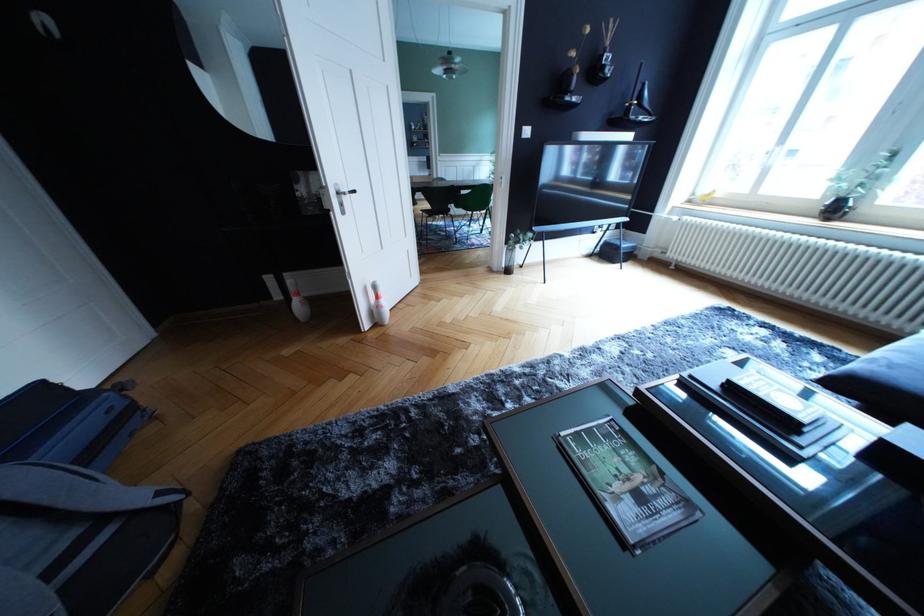
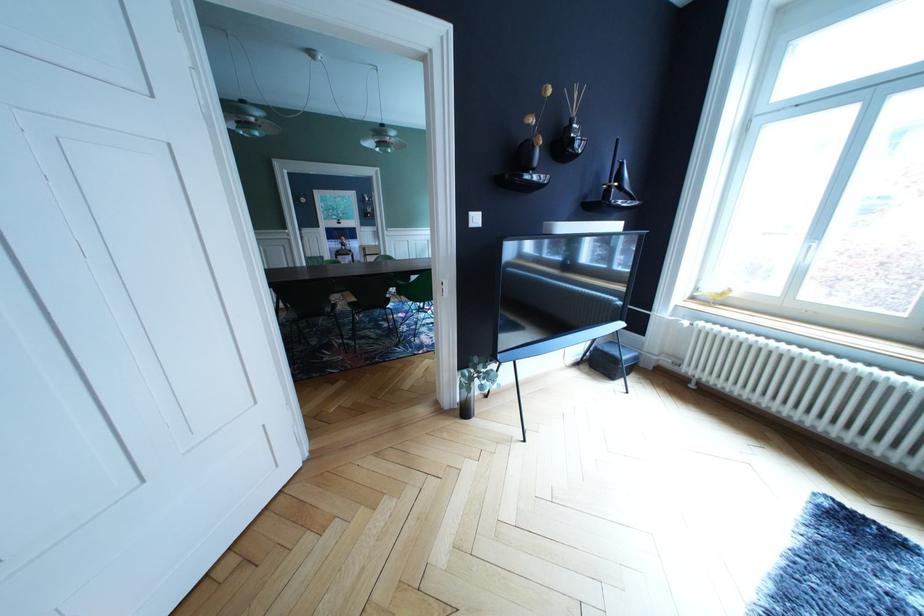
The point at (x=648, y=103) is marked in the first image. Where is the corresponding point in the second image?

(628, 184)